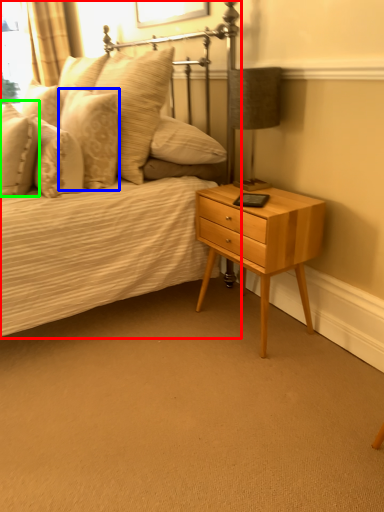
Question: Which object is the farthest from bed (highlighted by a red box)? Choose among these: pillow (highlighted by a blue box) or pillow (highlighted by a green box).

Choices:
 (A) pillow
 (B) pillow

Answer: (B)